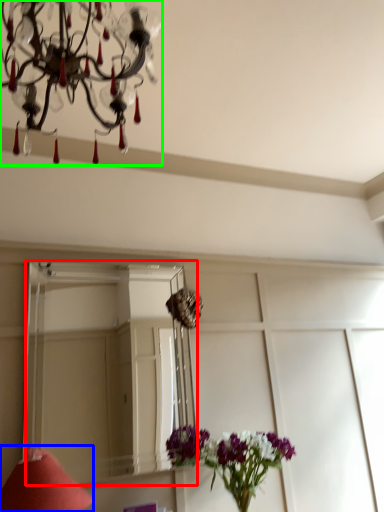
Question: Which object is the farthest from mirror (highlighted by a red box)? Choose among these: table lamp (highlighted by a blue box) or lamp (highlighted by a green box).

Choices:
 (A) table lamp
 (B) lamp

Answer: (B)